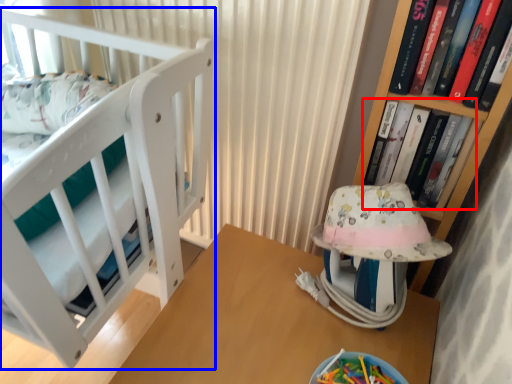
Question: Among these objects, which one is nearest to the camera, book (highlighted by a red box) or furniture (highlighted by a blue box)?

Choices:
 (A) book
 (B) furniture

Answer: (B)